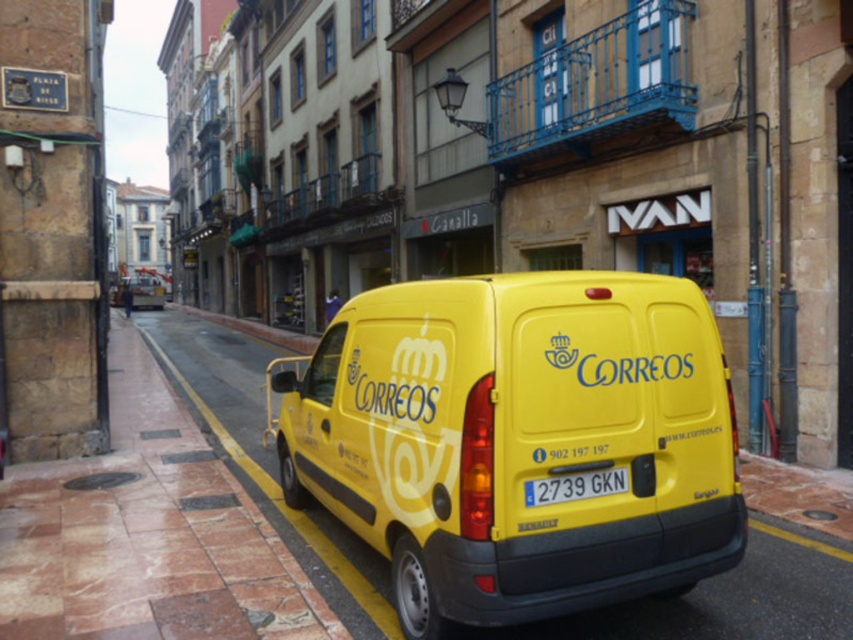
Question: Which object appears closest to the camera in this image?

Choices:
 (A) yellow plastic license plate at center
 (B) yellow painted curb at lower left
 (C) yellow matte van at center

Answer: (C)

Question: Estimate the real-world distances between objects in this image. Which object is closer to the yellow painted curb at lower left?

Choices:
 (A) yellow matte van at center
 (B) yellow plastic license plate at center

Answer: (A)

Question: Where is yellow painted curb at lower left located in relation to yellow plastic license plate at center in the image?

Choices:
 (A) left
 (B) right

Answer: (A)

Question: Is yellow matte van at center further to the viewer compared to yellow painted curb at lower left?

Choices:
 (A) no
 (B) yes

Answer: (A)

Question: Can you confirm if yellow matte van at center is smaller than yellow plastic license plate at center?

Choices:
 (A) no
 (B) yes

Answer: (A)

Question: Considering the real-world distances, which object is farthest from the yellow matte van at center?

Choices:
 (A) yellow plastic license plate at center
 (B) yellow painted curb at lower left

Answer: (B)